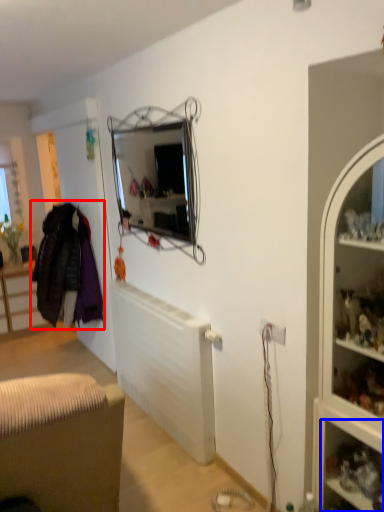
Question: Which object is further to the camera taking this photo, clothing (highlighted by a red box) or shelf (highlighted by a blue box)?

Choices:
 (A) clothing
 (B) shelf

Answer: (A)